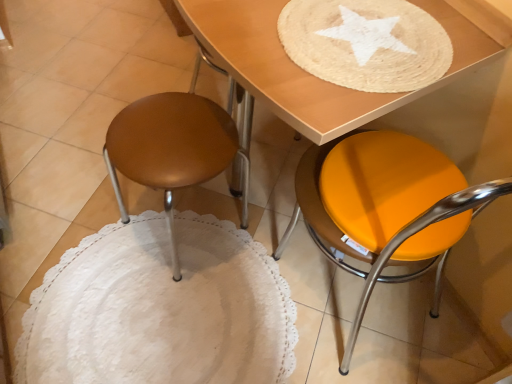
This screenshot has width=512, height=384. I want to click on unoccupied region to the right of matte brown stool at left, so click(x=273, y=235).